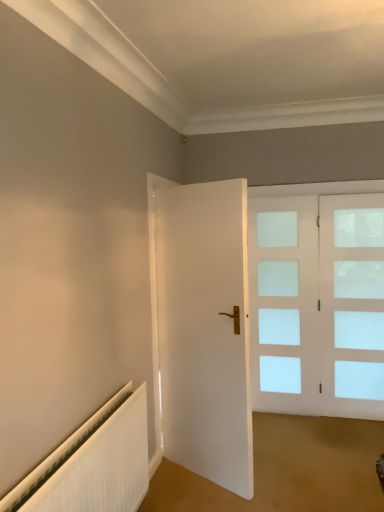
Identify the location of white matte door at center. tap(204, 330).

Is clear glass door at right taller than white matte door at center?

In fact, clear glass door at right may be shorter than white matte door at center.

From the image's perspective, does clear glass door at right appear higher than white matte door at center?

Yes, from the image's perspective, clear glass door at right is on top of white matte door at center.

Based on the photo, between clear glass door at right and white matte door at center, which one has smaller width?

clear glass door at right.

You are a GUI agent. You are given a task and a screenshot of the screen. Output one action in this format:
    pyautogui.click(x=<x>, y=<y>)
    Task: Click on the window on the right of white matte door at center
    This screenshot has width=384, height=512.
    Given the screenshot: What is the action you would take?
    pyautogui.click(x=352, y=305)

Would you say white ribbed radiator at lower left is to the left or to the right of clear glass door at right in the picture?

white ribbed radiator at lower left is to the left of clear glass door at right.

Does white ribbed radiator at lower left come in front of clear glass door at right?

Yes, white ribbed radiator at lower left is closer to the viewer.

From the picture: Considering the sizes of objects white ribbed radiator at lower left and clear glass door at right in the image provided, who is shorter, white ribbed radiator at lower left or clear glass door at right?

white ribbed radiator at lower left.

How different are the orientations of white ribbed radiator at lower left and clear glass door at right in degrees?

The angular difference between white ribbed radiator at lower left and clear glass door at right is 90.5 degrees.

Is white matte door at center turned away from clear glass door at right?

No.

From the image's perspective, which one is positioned lower, white matte door at center or clear glass door at right?

From the image's view, white matte door at center is below.

From a real-world perspective, which is physically above, white matte door at center or clear glass door at right?

From a 3D spatial view, white matte door at center is above.

From the image's perspective, which is below, white matte door at center or white ribbed radiator at lower left?

white ribbed radiator at lower left is shown below in the image.

The height and width of the screenshot is (512, 384). What are the coordinates of `door that is on the right side of white ribbed radiator at lower left` in the screenshot? It's located at (204, 330).

Choose the correct answer: Is white matte door at center inside white ribbed radiator at lower left or outside it?

white matte door at center is located beyond the bounds of white ribbed radiator at lower left.

How different are the orientations of white matte door at center and white ribbed radiator at lower left in degrees?

The angle between the facing direction of white matte door at center and the facing direction of white ribbed radiator at lower left is 60.4 degrees.

Would you say clear glass door at right is a long distance from white ribbed radiator at lower left?

Yes.

How different are the orientations of clear glass door at right and white ribbed radiator at lower left in degrees?

There is a 90.5-degree angle between the facing directions of clear glass door at right and white ribbed radiator at lower left.

Does clear glass door at right turn towards white ribbed radiator at lower left?

No, clear glass door at right is not turned towards white ribbed radiator at lower left.

In terms of size, does clear glass door at right appear bigger or smaller than white ribbed radiator at lower left?

Result: Considering their sizes, clear glass door at right takes up less space than white ribbed radiator at lower left.

Which object is positioned more to the right, white ribbed radiator at lower left or white matte door at center?

From the viewer's perspective, white matte door at center appears more on the right side.

Consider the image. From a real-world perspective, is white ribbed radiator at lower left located beneath white matte door at center?

Indeed, from a real-world perspective, white ribbed radiator at lower left is positioned beneath white matte door at center.

Where is `door that appears behind the white ribbed radiator at lower left`? This screenshot has width=384, height=512. door that appears behind the white ribbed radiator at lower left is located at coordinates (204, 330).

Which is nearer, (3, 506) or (167, 256)?

Point (3, 506) appears to be closer to the viewer than point (167, 256).

This screenshot has width=384, height=512. Identify the location of window located above the white matte door at center (from the image's perspective). (352, 305).

I want to click on window behind the white ribbed radiator at lower left, so click(x=352, y=305).

Which object lies further to the anchor point white matte door at center, white ribbed radiator at lower left or clear glass door at right?

Based on the image, clear glass door at right appears to be further to white matte door at center.

Estimate the real-world distances between objects in this image. Which object is further from clear glass door at right, white matte door at center or white ribbed radiator at lower left?

white ribbed radiator at lower left is positioned further to the anchor clear glass door at right.

Which object lies further to the anchor point white matte door at center, clear glass door at right or white ribbed radiator at lower left?

clear glass door at right.

Based on their spatial positions, is white ribbed radiator at lower left or white matte door at center closer to clear glass door at right?

Based on the image, white matte door at center appears to be nearer to clear glass door at right.

When comparing their distances from white ribbed radiator at lower left, does clear glass door at right or white matte door at center seem closer?

Among the two, white matte door at center is located nearer to white ribbed radiator at lower left.

Estimate the real-world distances between objects in this image. Which object is closer to white ribbed radiator at lower left, white matte door at center or clear glass door at right?

Based on the image, white matte door at center appears to be nearer to white ribbed radiator at lower left.

You are a GUI agent. You are given a task and a screenshot of the screen. Output one action in this format:
    pyautogui.click(x=<x>, y=<y>)
    Task: Click on the door between white ribbed radiator at lower left and clear glass door at right along the z-axis
    The height and width of the screenshot is (512, 384).
    Given the screenshot: What is the action you would take?
    pyautogui.click(x=204, y=330)